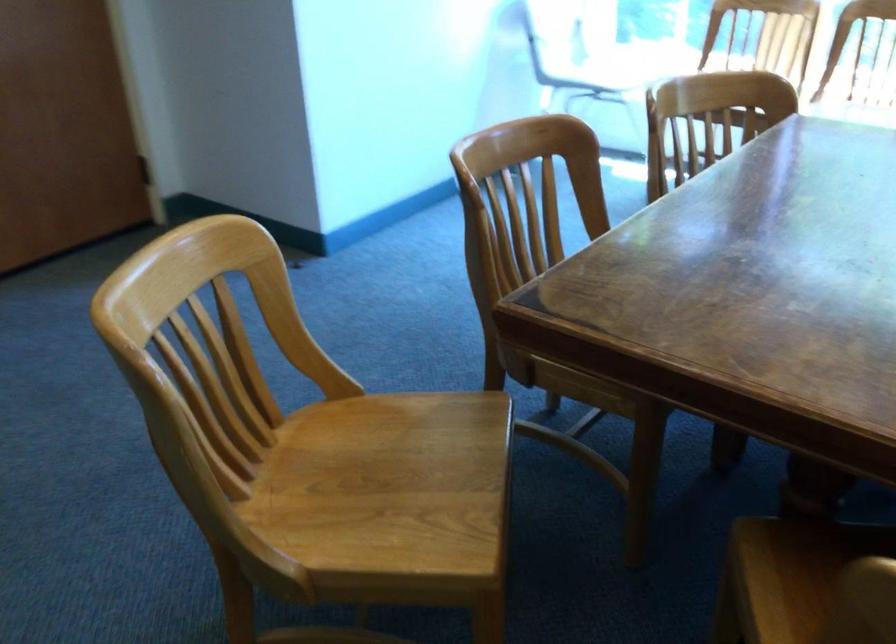
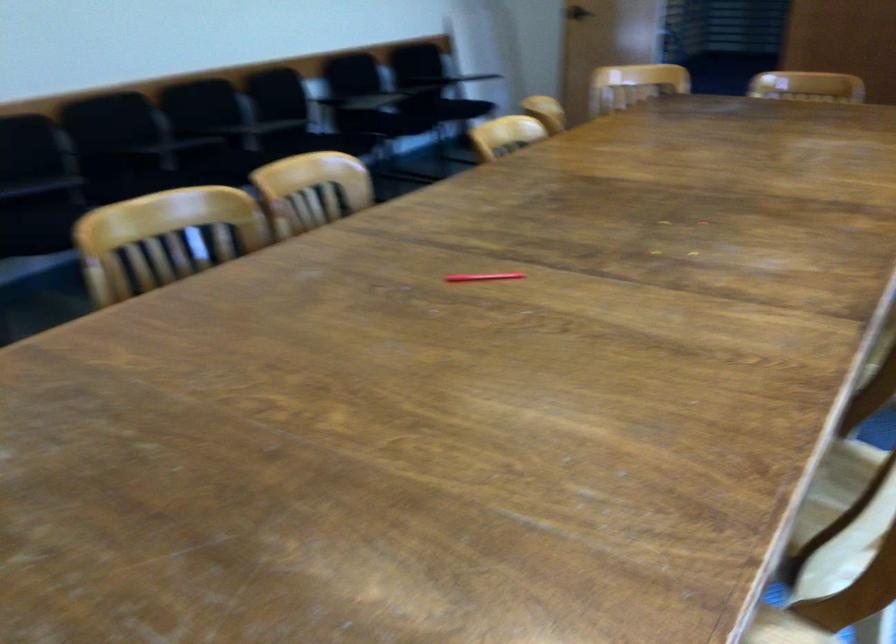
Question: I am providing you with two images of the same scene from different viewpoints. After the viewpoint changes to image2, which objects are now occluded?

Choices:
 (A) red pen
 (B) door knob
 (C) black chair sitting surface
 (D) wooden chair sitting surface

Answer: (D)